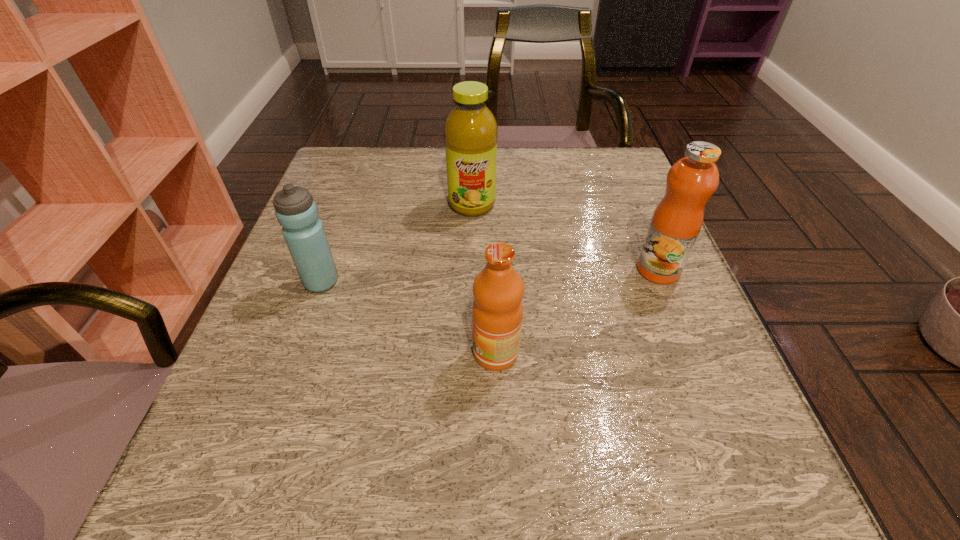
This screenshot has height=540, width=960. What are the coordinates of `the farthest object` in the screenshot? It's located at (470, 131).

The height and width of the screenshot is (540, 960). What are the coordinates of `the second nearest fruit juice` in the screenshot? It's located at (677, 220).

Locate an element on the screen. This screenshot has width=960, height=540. the rightmost object is located at coordinates (677, 220).

Image resolution: width=960 pixels, height=540 pixels. Identify the location of the nearest object. (498, 290).

You are a GUI agent. You are given a task and a screenshot of the screen. Output one action in this format:
    pyautogui.click(x=<x>, y=<y>)
    Task: Click on the shortest fruit juice
    Image resolution: width=960 pixels, height=540 pixels.
    Given the screenshot: What is the action you would take?
    pyautogui.click(x=498, y=290)

Image resolution: width=960 pixels, height=540 pixels. Identify the location of the leftmost object. (297, 213).

Locate an element on the screen. This screenshot has width=960, height=540. vacant area situated on the front label of the farthest object is located at coordinates (468, 352).

Where is `free location located 0.160m on the back of the rightmost object`? The image size is (960, 540). free location located 0.160m on the back of the rightmost object is located at coordinates (633, 209).

The width and height of the screenshot is (960, 540). What are the coordinates of `free space located 0.370m on the label side of the nearest fruit juice` in the screenshot? It's located at (250, 353).

Where is `free space located on the label side of the nearest fruit juice`? The image size is (960, 540). free space located on the label side of the nearest fruit juice is located at coordinates (407, 353).